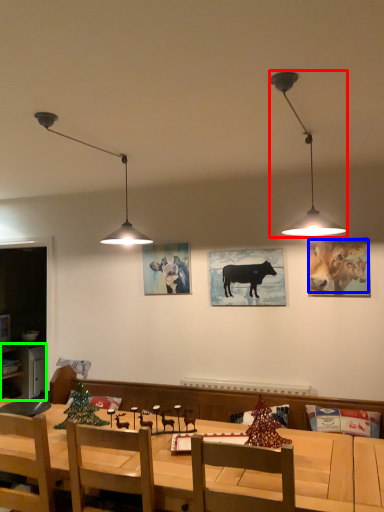
Question: Based on their relative distances, which object is farther from lamp (highlighted by a red box)? Choose from cattle (highlighted by a blue box) and cabinetry (highlighted by a green box).

Choices:
 (A) cattle
 (B) cabinetry

Answer: (B)